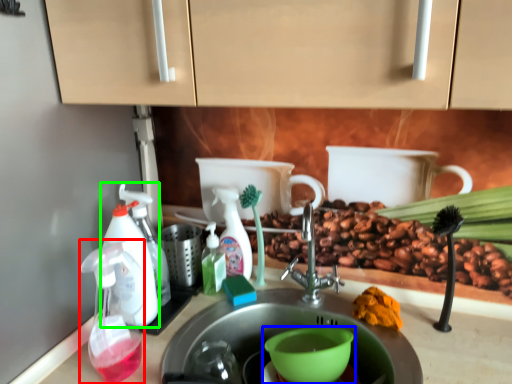
Question: Based on their relative distances, which object is nearer to soap dispenser (highlighted by a red box)? Choose from coffee cup (highlighted by a blue box) and soap dispenser (highlighted by a green box).

Choices:
 (A) coffee cup
 (B) soap dispenser

Answer: (B)